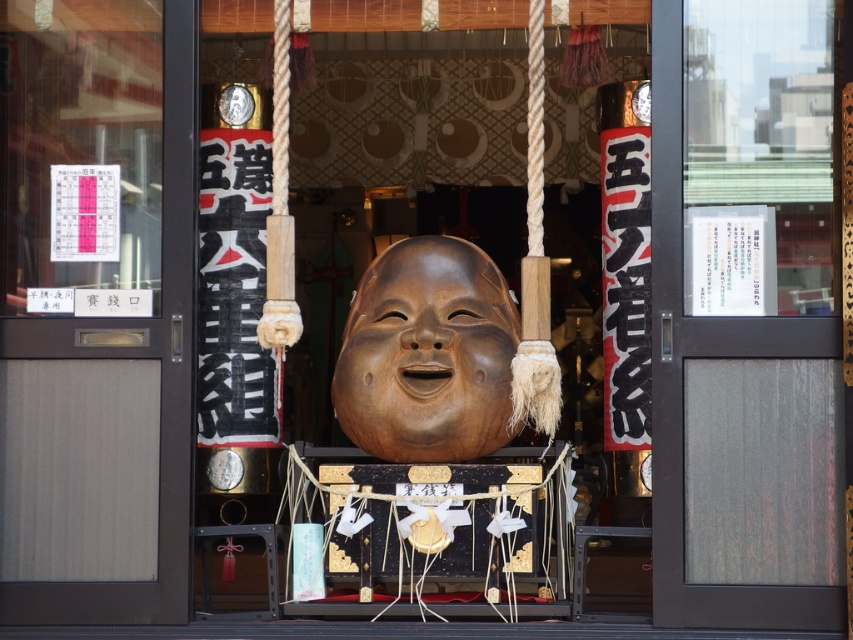
Question: Is wooden mask at center to the right of transparent glass door at center from the viewer's perspective?

Choices:
 (A) yes
 (B) no

Answer: (B)

Question: Which is nearer to the wooden statue at center?

Choices:
 (A) transparent glass door at center
 (B) wooden mask at center

Answer: (B)

Question: Which object appears farthest from the camera in this image?

Choices:
 (A) wooden mask at center
 (B) transparent glass door at center

Answer: (A)

Question: Is wooden statue at center to the left of transparent glass door at center from the viewer's perspective?

Choices:
 (A) yes
 (B) no

Answer: (A)

Question: Can you confirm if wooden mask at center is smaller than transparent glass door at center?

Choices:
 (A) yes
 (B) no

Answer: (B)

Question: Which object is closer to the camera taking this photo?

Choices:
 (A) transparent glass door at center
 (B) wooden statue at center
 (C) wooden mask at center

Answer: (A)